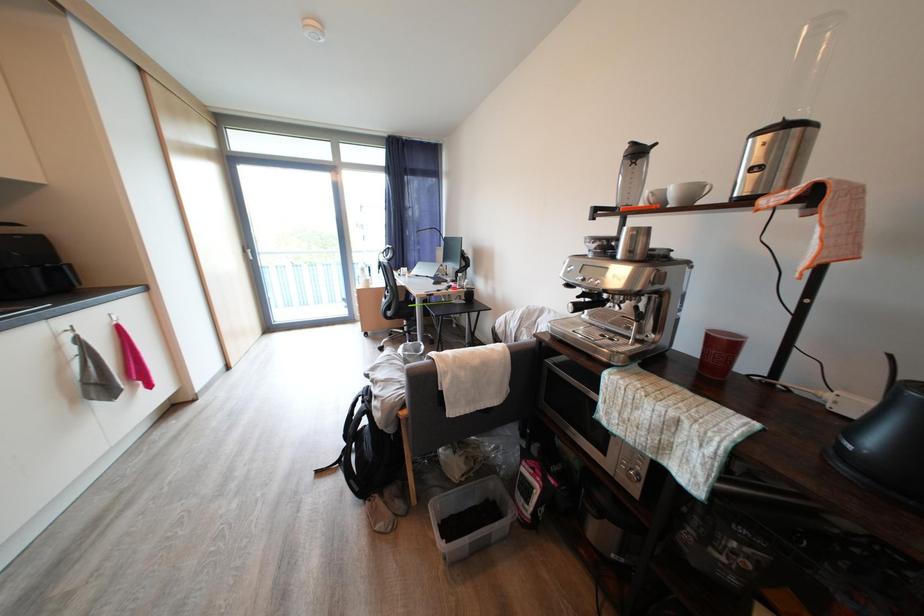
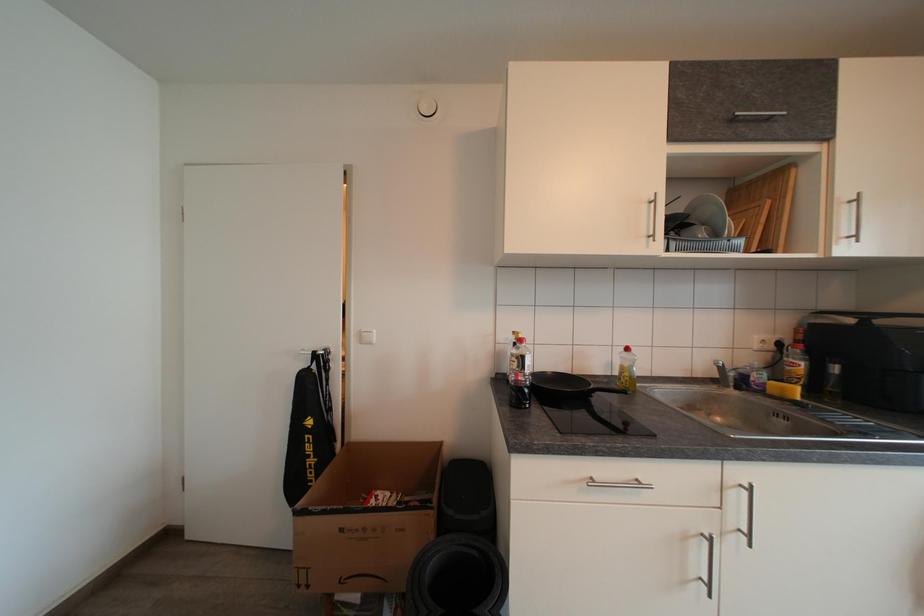
Question: The images are taken continuously from a first-person perspective. In which direction is your viewpoint rotating?

Choices:
 (A) Left
 (B) Right
 (C) Up
 (D) Down

Answer: (A)